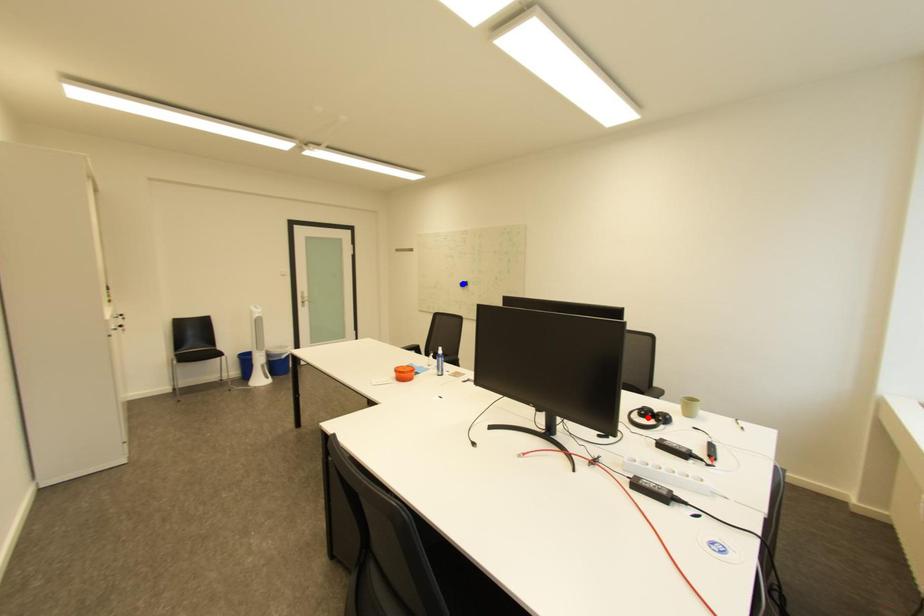
Question: In the image, two points are highlighted. Which point is nearer to the camera? Reply with the corresponding letter.

Choices:
 (A) blue point
 (B) red point

Answer: (B)